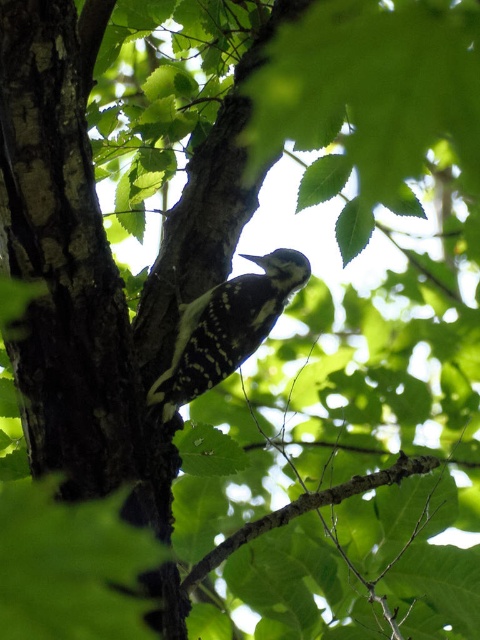
You are a birdwatcher observing the woodpecker in the scene. You notice a specific point marked at coordinates point (71, 273). What is located at that point?

At point (71, 273) lies dark brown bark at center.

Consider the image. You are a birdwatcher observing the scene. You notice the dark brown bark at center and the black and white speckled woodpecker at center. Which object appears wider in the image?

The black and white speckled woodpecker at center appears wider than the dark brown bark at center because the bark is thinner.

You are a birdwatcher observing the scene. You notice the dark brown bark at center and the black and white speckled woodpecker at center. Which object takes up more space in the image?

The dark brown bark at center is larger in size than the black and white speckled woodpecker at center, so it takes up more space in the image.